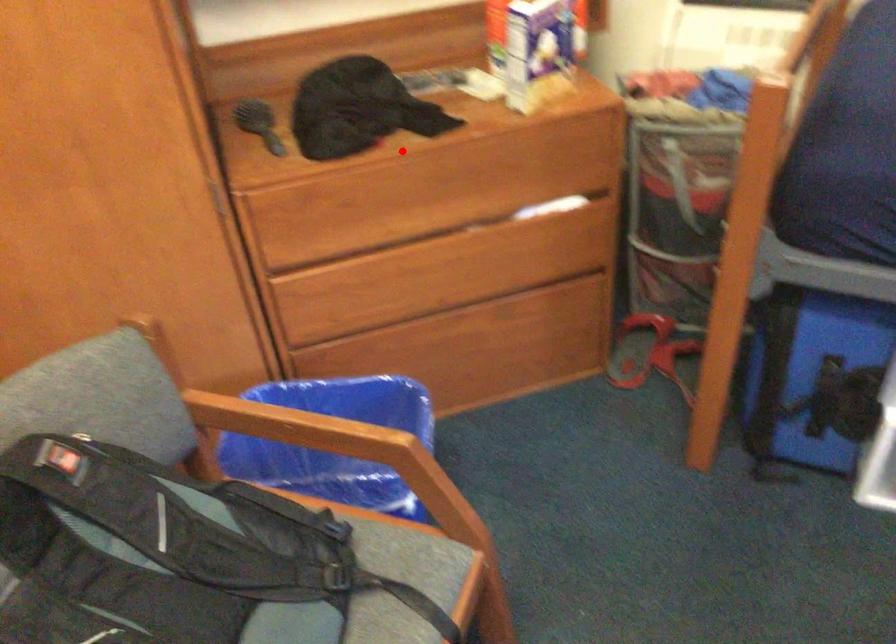
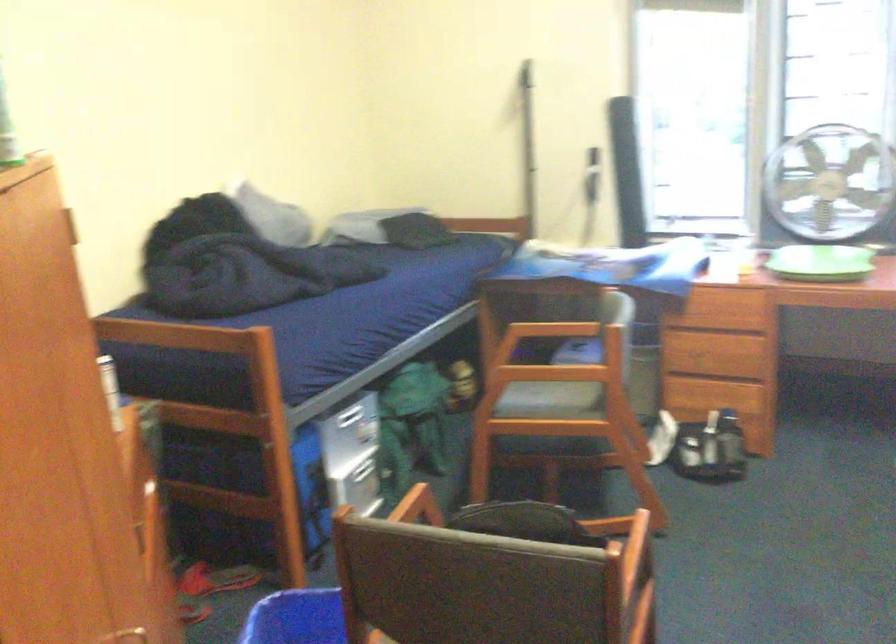
Question: I am providing you with two images of the same scene from different viewpoints. A red point is marked on the first image. Can you still see the location of the red point in image 2?

Choices:
 (A) Yes
 (B) No

Answer: (B)